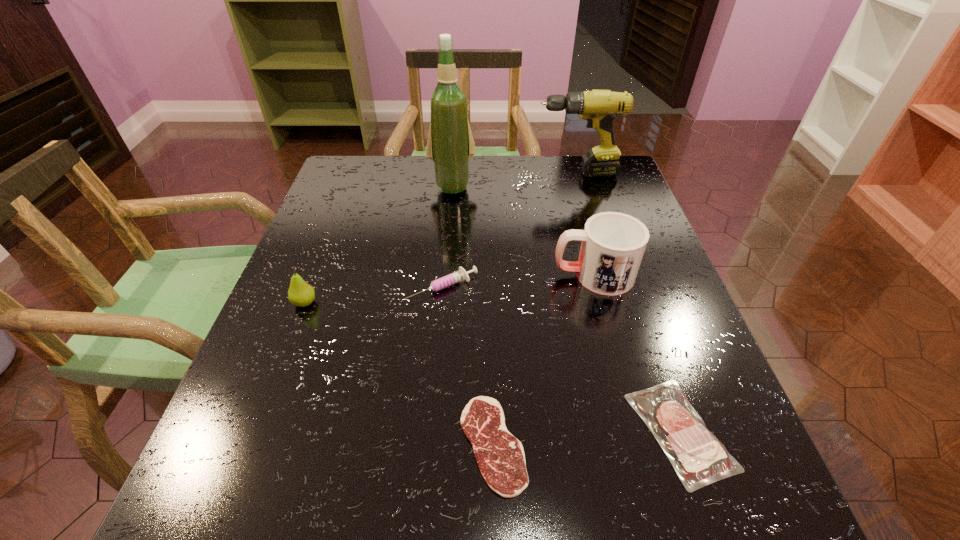
Where is `free space between the third shortest object and the tallest object`? This screenshot has width=960, height=540. free space between the third shortest object and the tallest object is located at coordinates (447, 237).

Image resolution: width=960 pixels, height=540 pixels. In order to click on free space between the taller steak and the syringe in this screenshot , I will do `click(562, 360)`.

Image resolution: width=960 pixels, height=540 pixels. In order to click on vacant space that's between the right steak and the leftmost object in this screenshot , I will do `click(492, 367)`.

Locate an element on the screen. free space between the drill and the fifth tallest object is located at coordinates (509, 231).

Locate an element on the screen. This screenshot has height=540, width=960. free space between the sixth shortest object and the fifth tallest object is located at coordinates (509, 231).

Identify the location of free space that is in between the right steak and the fifth tallest object. (562, 360).

Where is `object that is the fifth closest to the mug`? Image resolution: width=960 pixels, height=540 pixels. object that is the fifth closest to the mug is located at coordinates (599, 107).

At what (x,y) coordinates should I click in order to perform the action: click on object that can be found as the second closest to the left steak. Please return your answer as a coordinate pair (x, y). The width and height of the screenshot is (960, 540). Looking at the image, I should click on (460, 275).

Find the location of `free space that satisfies the following two spatial constraints: 1. on the handle side of the drill; 2. on the front-facing side of the wine bottle`. free space that satisfies the following two spatial constraints: 1. on the handle side of the drill; 2. on the front-facing side of the wine bottle is located at coordinates (580, 186).

Locate an element on the screen. Image resolution: width=960 pixels, height=540 pixels. vacant space that satisfies the following two spatial constraints: 1. on the handle side of the second shortest object; 2. on the right side of the drill is located at coordinates (652, 431).